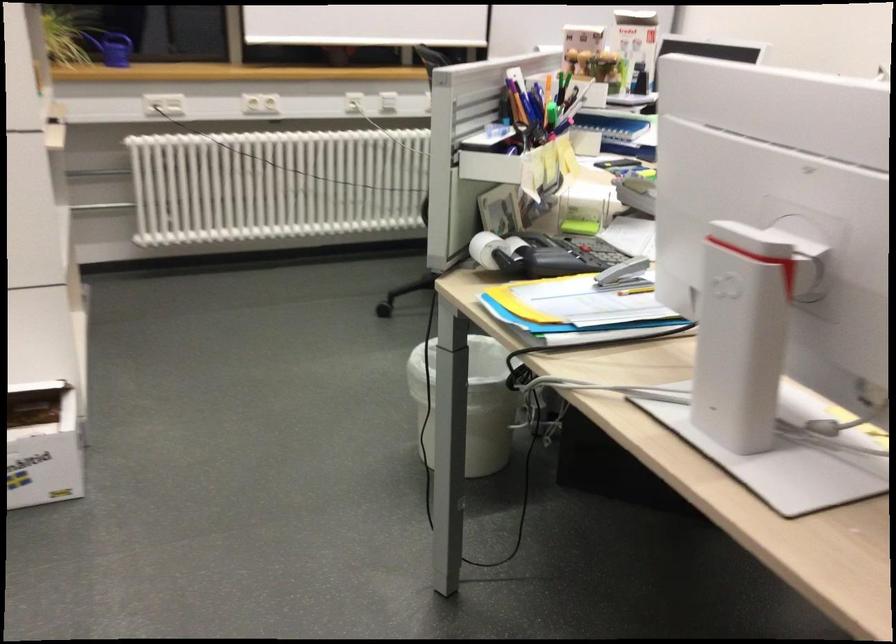
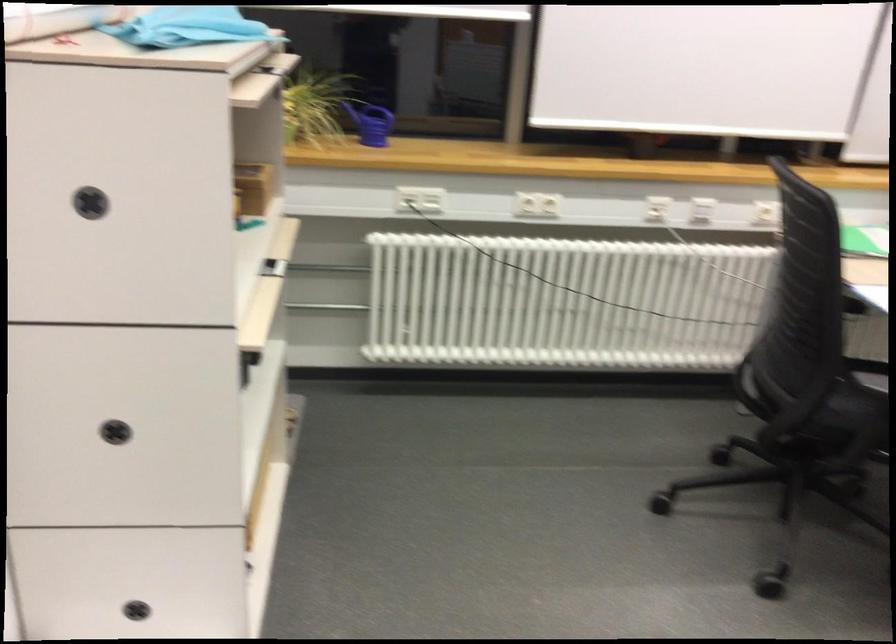
Find the pixel in the second image that matches the point at 162,100 in the first image.

(419, 199)